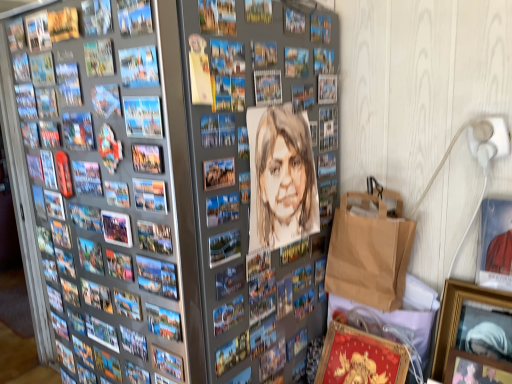
Question: From the image's perspective, is matte paper comic book at upper left, the second comic book when ordered from front to back, over watercolor portrait at center, positioned as the first comic book in front-to-back order?

Choices:
 (A) no
 (B) yes

Answer: (B)

Question: Is matte paper comic book at upper left, the second comic book when ordered from front to back, positioned before watercolor portrait at center, the fourth comic book in the back-to-front sequence?

Choices:
 (A) yes
 (B) no

Answer: (B)

Question: Does matte paper comic book at upper left, the second comic book when ordered from front to back, have a greater height compared to watercolor portrait at center, which is the 4th comic book from left to right?

Choices:
 (A) no
 (B) yes

Answer: (A)

Question: Is matte paper comic book at upper left, the second comic book in the right-to-left sequence, completely or partially outside of watercolor portrait at center, which is the 4th comic book from left to right?

Choices:
 (A) no
 (B) yes

Answer: (A)

Question: Considering the relative positions of matte paper comic book at upper left, which ranks as the third comic book in left-to-right order, and watercolor portrait at center, positioned as the first comic book in front-to-back order, in the image provided, is matte paper comic book at upper left, which ranks as the third comic book in left-to-right order, to the right of watercolor portrait at center, positioned as the first comic book in front-to-back order, from the viewer's perspective?

Choices:
 (A) no
 (B) yes

Answer: (A)

Question: Visually, is metallic silver picture frame at center, arranged as the first picture frame when viewed from the left, positioned to the left or to the right of brown paper bag at lower right?

Choices:
 (A) left
 (B) right

Answer: (A)

Question: From the image's perspective, is metallic silver picture frame at center, arranged as the first picture frame when viewed from the left, above or below brown paper bag at lower right?

Choices:
 (A) below
 (B) above

Answer: (A)

Question: Does point (136, 319) appear closer or farther from the camera than point (347, 221)?

Choices:
 (A) farther
 (B) closer

Answer: (B)

Question: Is metallic silver picture frame at center, arranged as the first picture frame when viewed from the left, in front of or behind brown paper bag at lower right in the image?

Choices:
 (A) behind
 (B) front

Answer: (B)

Question: Looking at the image, does watercolor portrait at center, which is the 4th comic book from left to right, seem bigger or smaller compared to wooden picture frame at lower right, which appears as the first picture frame when viewed from the right?

Choices:
 (A) small
 (B) big

Answer: (B)

Question: From a real-world perspective, is watercolor portrait at center, the first comic book from the right, physically located above or below wooden picture frame at lower right, placed as the 6th picture frame when sorted from left to right?

Choices:
 (A) below
 (B) above

Answer: (B)

Question: Does point (94, 190) appear closer or farther from the camera than point (505, 299)?

Choices:
 (A) farther
 (B) closer

Answer: (B)

Question: Considering their positions, is watercolor portrait at center, the first comic book from the right, located in front of or behind wooden picture frame at lower right, which appears as the first picture frame when viewed from the right?

Choices:
 (A) behind
 (B) front

Answer: (B)

Question: Is brown paper bag at lower right inside or outside of matte paper comic book at center, marked as the first comic book in a left-to-right arrangement?

Choices:
 (A) inside
 (B) outside

Answer: (B)

Question: Considering the positions of brown paper bag at lower right and matte paper comic book at center, placed as the fourth comic book when sorted from front to back, in the image, is brown paper bag at lower right taller or shorter than matte paper comic book at center, placed as the fourth comic book when sorted from front to back,?

Choices:
 (A) tall
 (B) short

Answer: (A)